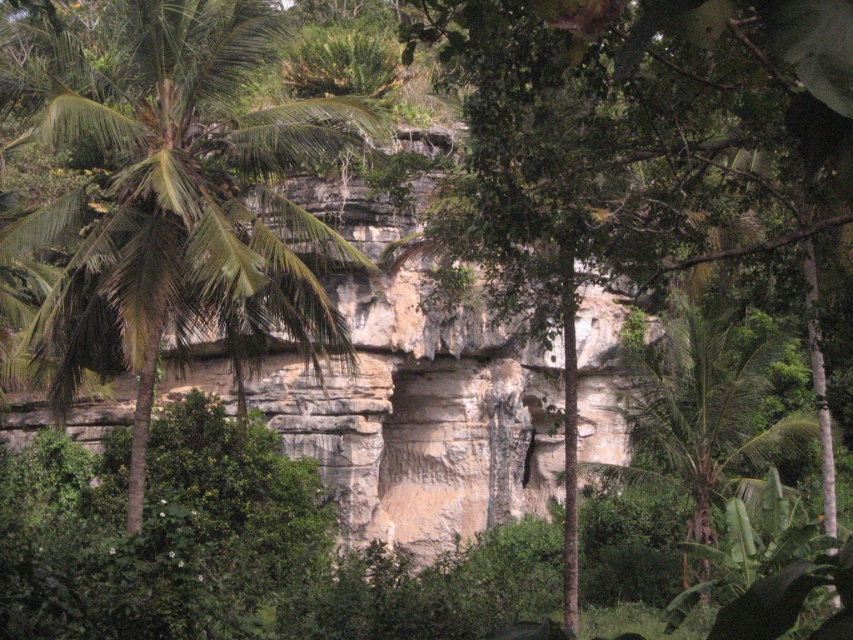
Based on the scene description, where is the green leafy palm tree at left located in terms of coordinates?

The green leafy palm tree at left is located at coordinates point [173,198].